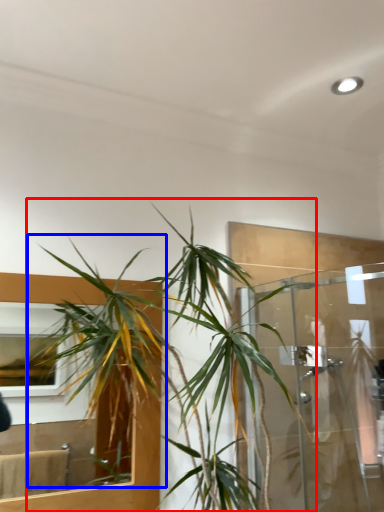
Question: Which point is closer to the camera, houseplant (highlighted by a red box) or vegetation (highlighted by a blue box)?

Choices:
 (A) houseplant
 (B) vegetation

Answer: (A)